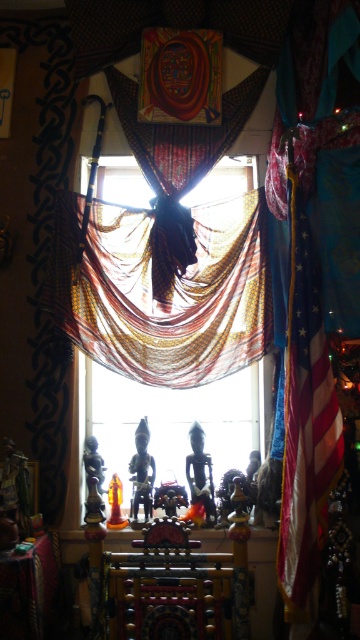
Which of these two, multicolored sheer fabric at center or american flag at right, stands taller?

american flag at right is taller.

Which is above, multicolored sheer fabric at center or american flag at right?

multicolored sheer fabric at center is higher up.

Who is more forward, (119,230) or (298,419)?

Point (298,419) is more forward.

This screenshot has height=640, width=360. Find the location of `multicolored sheer fabric at center`. multicolored sheer fabric at center is located at coordinates (173, 291).

Is american flag at right bigger than transparent fabric at center?

Yes, american flag at right is bigger than transparent fabric at center.

Is american flag at right shorter than transparent fabric at center?

No, american flag at right is not shorter than transparent fabric at center.

Which is in front, point (302, 566) or point (150, 388)?

Positioned in front is point (302, 566).

Find the location of `american flag at right`. american flag at right is located at coordinates (306, 422).

Measure the distance between point [222,212] and camera.

Point [222,212] and camera are 2.67 meters apart.

Between point (209, 253) and point (190, 403), which one is positioned in front?

Point (209, 253) is more forward.

This screenshot has width=360, height=640. What do you see at coordinates (173, 291) in the screenshot?
I see `multicolored sheer fabric at center` at bounding box center [173, 291].

This screenshot has width=360, height=640. In order to click on multicolored sheer fabric at center in this screenshot , I will do click(173, 291).